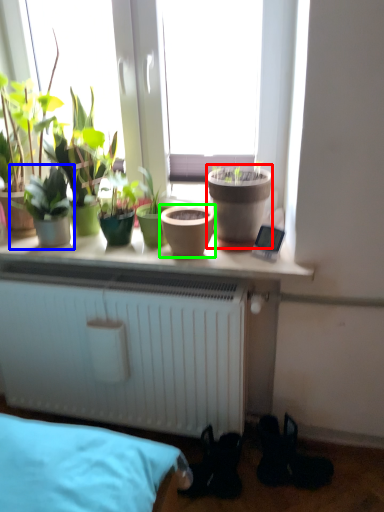
Question: Which object is positioned farthest from flowerpot (highlighted by a red box)? Select from houseplant (highlighted by a blue box) and flowerpot (highlighted by a green box).

Choices:
 (A) houseplant
 (B) flowerpot

Answer: (A)